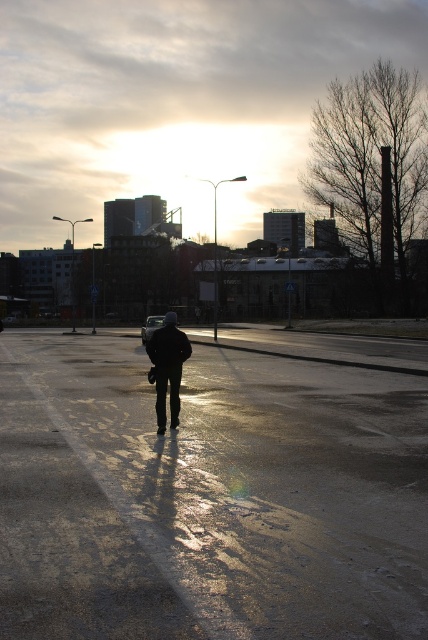
Is shiny asphalt parking lot at center above dark matte jacket at center?

No, shiny asphalt parking lot at center is not above dark matte jacket at center.

Who is more forward, (379, 378) or (171, 387)?

Point (171, 387) is in front.

Where is `shiny asphalt parking lot at center`? This screenshot has width=428, height=640. shiny asphalt parking lot at center is located at coordinates (208, 497).